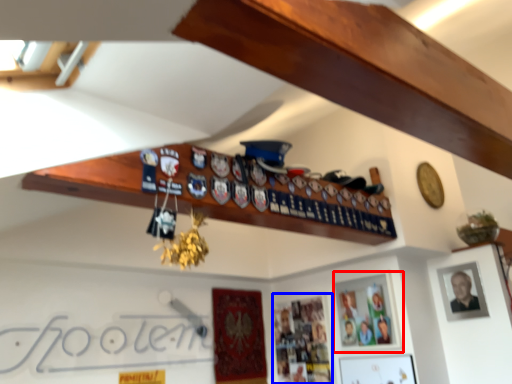
Question: Which object appears farthest to the camera in this image, picture frame (highlighted by a red box) or picture frame (highlighted by a blue box)?

Choices:
 (A) picture frame
 (B) picture frame

Answer: (B)